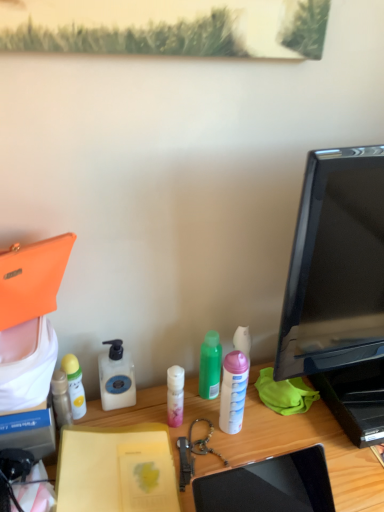
In order to click on free area in between white matte bottle at center, marked as the third bottle in a left-to-right arrangement, and green matte bottle at center, placed as the fourth bottle when sorted from left to right in this screenshot , I will do 162,400.